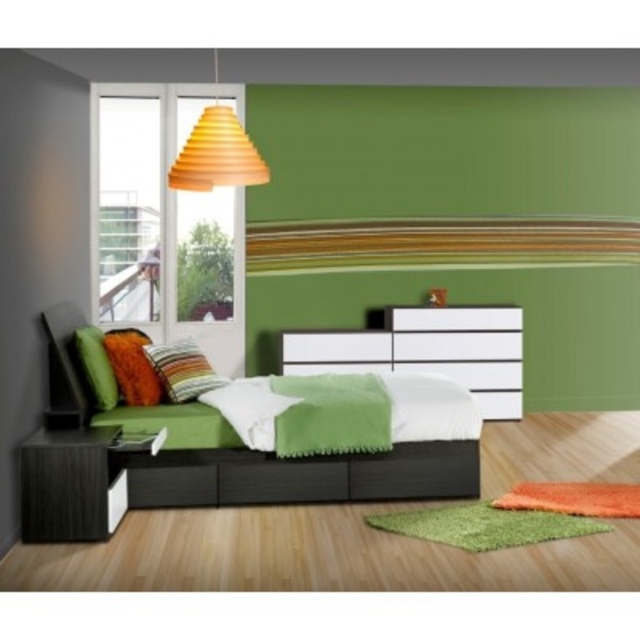
Question: Which object appears farthest from the camera in this image?

Choices:
 (A) white glossy dresser at center
 (B) matte black bed at center

Answer: (A)

Question: Can you confirm if white glossy dresser at center is positioned below green fabric pillow at left?

Choices:
 (A) no
 (B) yes

Answer: (B)

Question: Is matte black bed at center above orange matte cone at upper center?

Choices:
 (A) no
 (B) yes

Answer: (A)

Question: Estimate the real-world distances between objects in this image. Which object is farther from the velvet orange pillow at center?

Choices:
 (A) green fabric pillow at left
 (B) white glossy dresser at center

Answer: (B)

Question: Estimate the real-world distances between objects in this image. Which object is closer to the matte black bed at center?

Choices:
 (A) green fabric pillow at left
 (B) orange matte cone at upper center
 (C) white glossy dresser at center

Answer: (A)

Question: Is striped fabric pillow at left below velvet orange pillow at center?

Choices:
 (A) yes
 (B) no

Answer: (A)